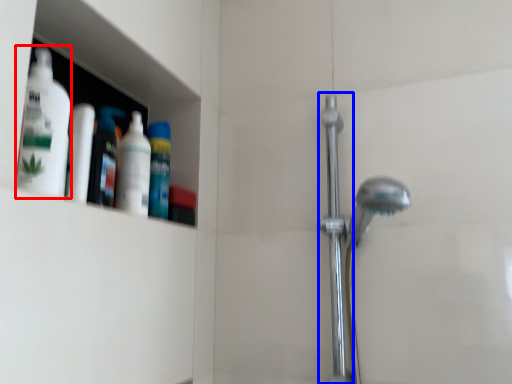
Question: Which of the following is the closest to the observer, cleaning product (highlighted by a red box) or shower door (highlighted by a blue box)?

Choices:
 (A) cleaning product
 (B) shower door

Answer: (A)